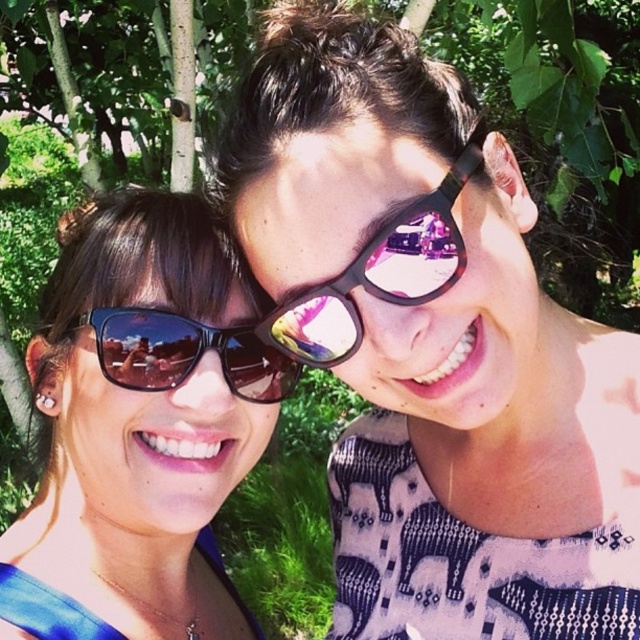
Between black reflective sunglasses at center and sunglasses at center, which one is positioned lower?

sunglasses at center is below.

Can you confirm if black reflective sunglasses at center is taller than sunglasses at center?

Yes, black reflective sunglasses at center is taller than sunglasses at center.

Describe the element at coordinates (378, 275) in the screenshot. This screenshot has height=640, width=640. I see `black reflective sunglasses at center` at that location.

Identify the location of black reflective sunglasses at center. This screenshot has height=640, width=640. (378, 275).

Is point (392, 80) closer to camera compared to point (212, 346)?

Yes, it is.

Can you confirm if matte black sunglasses at upper right is shorter than sunglasses at center?

In fact, matte black sunglasses at upper right may be taller than sunglasses at center.

Which is behind, point (362, 125) or point (168, 316)?

Point (168, 316)

Locate an element on the screen. Image resolution: width=640 pixels, height=640 pixels. matte black sunglasses at upper right is located at coordinates (433, 346).

Can you confirm if matte black sunglasses at left is wider than black reflective sunglasses at center?

Yes, matte black sunglasses at left is wider than black reflective sunglasses at center.

You are a GUI agent. You are given a task and a screenshot of the screen. Output one action in this format:
    pyautogui.click(x=<x>, y=<y>)
    Task: Click on the matte black sunglasses at left
    This screenshot has height=640, width=640.
    Given the screenshot: What is the action you would take?
    pyautogui.click(x=140, y=426)